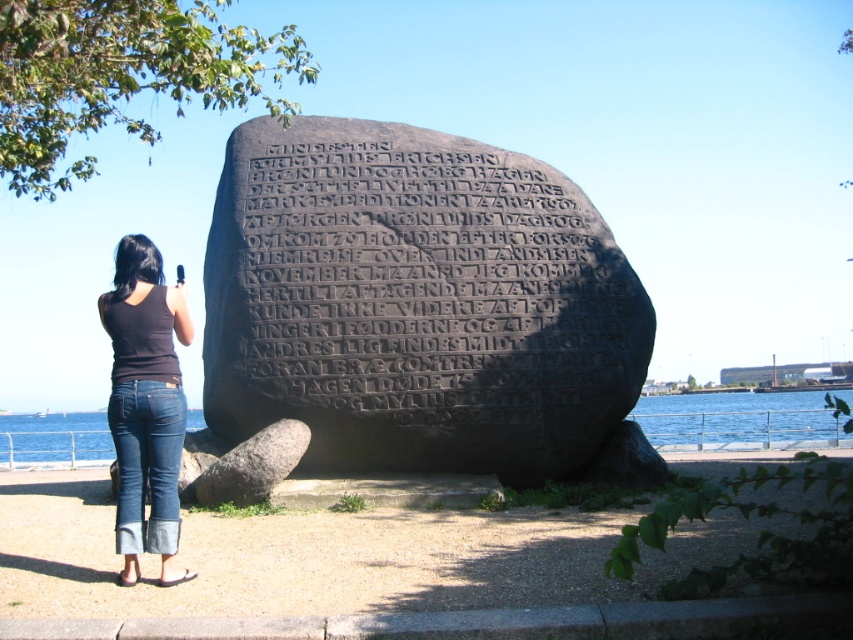
You are standing in front of the monument and notice the denim jeans at lower left and the blue water at lower center in the scene. Which object appears smaller in size?

The denim jeans at lower left has a smaller size compared to blue water at lower center, so the denim jeans at lower left appears smaller in size.